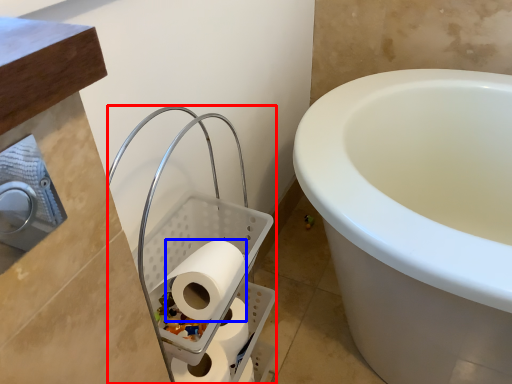
Question: Which object is closer to the camera taking this photo, laundry basket (highlighted by a red box) or toilet paper (highlighted by a blue box)?

Choices:
 (A) laundry basket
 (B) toilet paper

Answer: (A)